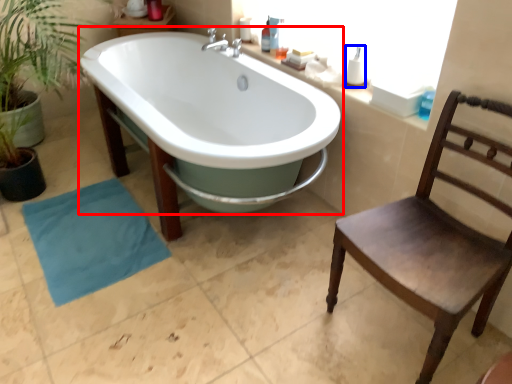
Question: Among these objects, which one is farthest to the camera, bathtub (highlighted by a red box) or toiletry (highlighted by a blue box)?

Choices:
 (A) bathtub
 (B) toiletry

Answer: (B)